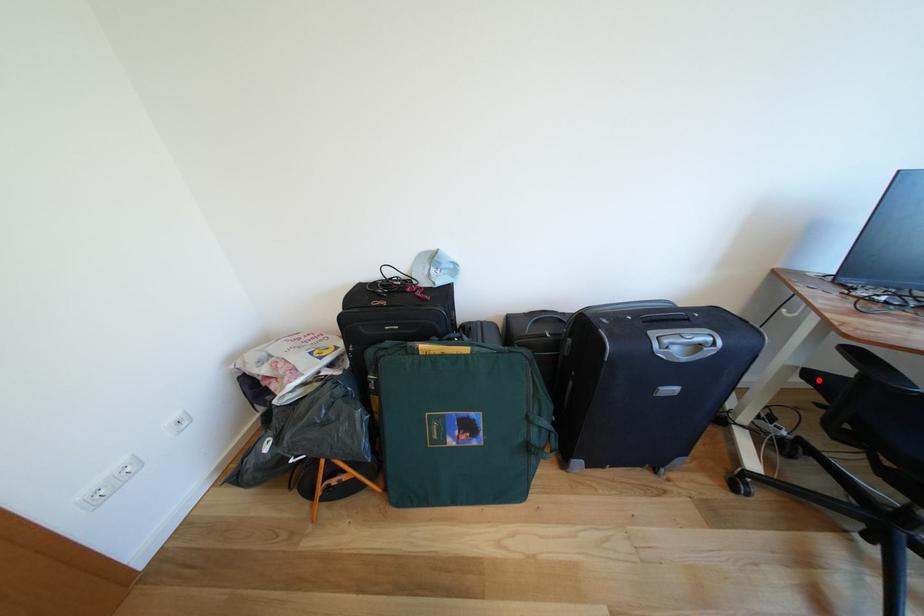
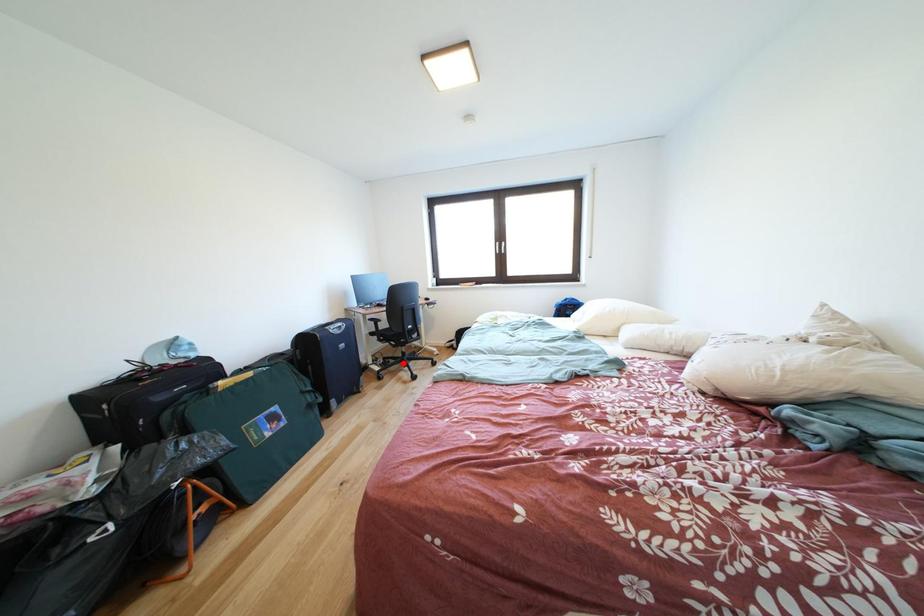
I am providing you with two images of the same scene from different viewpoints. A red point is marked on the first image and another point is marked on the second image. Are the points marked in image1 and image2 representing the same 3D position?

No